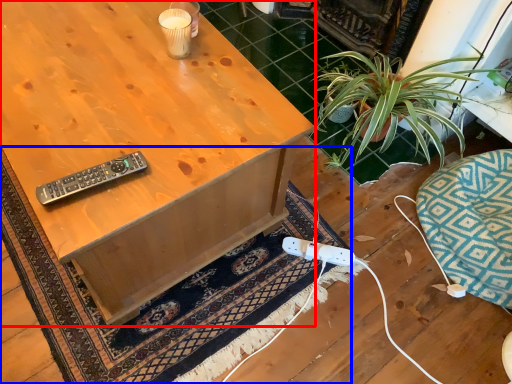
Question: Which object appears closest to the camera in this image, desk (highlighted by a red box) or doormat (highlighted by a blue box)?

Choices:
 (A) desk
 (B) doormat

Answer: (A)